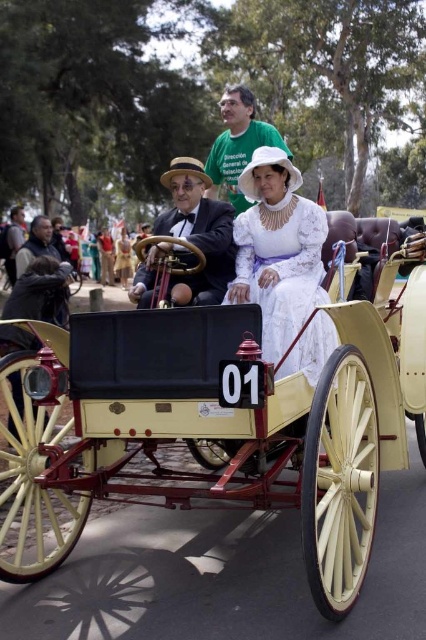
Question: Does matte black coach at center have a lesser width compared to white cotton dress at center?

Choices:
 (A) yes
 (B) no

Answer: (A)

Question: Is white lace dress at center to the left of matte black coach at center from the viewer's perspective?

Choices:
 (A) no
 (B) yes

Answer: (A)

Question: Which of the following is the farthest from the observer?

Choices:
 (A) matte black coach at center
 (B) white lace dress at center
 (C) light cream polished wood horse cart at center
 (D) white cotton dress at center

Answer: (D)

Question: Which of these objects is positioned farthest from the white lace dress at center?

Choices:
 (A) dark brown leather jacket at left
 (B) light cream polished wood horse cart at center
 (C) matte black coach at center
 (D) white cotton dress at center

Answer: (A)

Question: Can you confirm if white lace dress at center is smaller than dark brown leather jacket at left?

Choices:
 (A) yes
 (B) no

Answer: (B)

Question: Which of these objects is positioned farthest from the matte black coach at center?

Choices:
 (A) dark brown leather jacket at left
 (B) white cotton dress at center
 (C) light cream polished wood horse cart at center

Answer: (A)